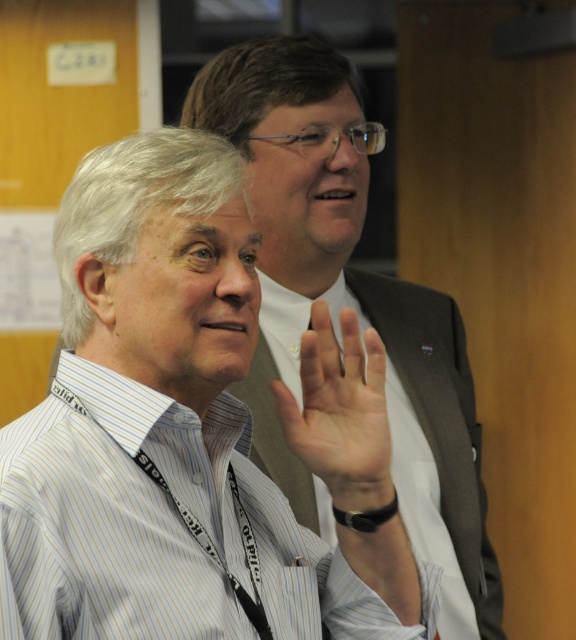
You are a photographer in a conference room. You see the gray fabric business suit at center and the pale skin palm at center. Which object is on the right side when viewed from the front?

The gray fabric business suit at center is positioned on the right side of the pale skin palm at center, so it is on the right side when viewed from the front.

You are a photographer trying to capture a candid shot of the gray fabric business suit at center. You notice a point marked at coordinates (441, 419). Can you confirm if this point is the exact location of the gray fabric business suit at center?

Yes, the point at coordinates (441, 419) corresponds to the gray fabric business suit at center, so it is the exact location.